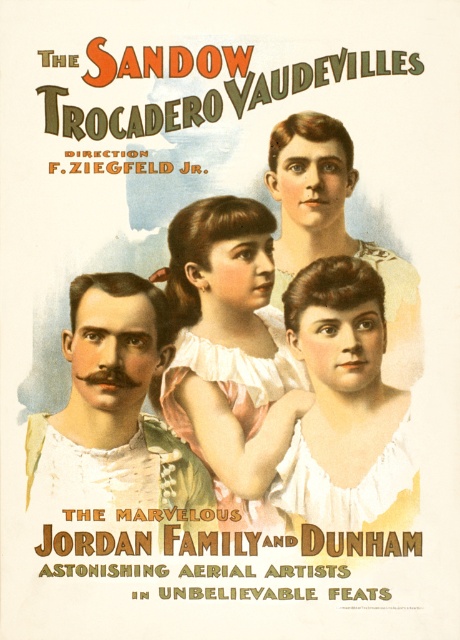
Question: Which object is closer to the camera taking this photo?

Choices:
 (A) matte white blouse at center
 (B) matte white blouse at upper center

Answer: (A)

Question: Does matte white blouse at center have a lesser width compared to matte white blouse at upper center?

Choices:
 (A) no
 (B) yes

Answer: (B)

Question: Does pink satin dress at center have a greater width compared to mustached man at center?

Choices:
 (A) yes
 (B) no

Answer: (B)

Question: Is pink satin dress at center thinner than mustached man at center?

Choices:
 (A) yes
 (B) no

Answer: (A)

Question: Which of these objects is positioned farthest from the matte white blouse at upper center?

Choices:
 (A) mustached man at center
 (B) pink satin dress at center
 (C) matte white blouse at center

Answer: (A)

Question: Which object appears closest to the camera in this image?

Choices:
 (A) mustached man at center
 (B) matte white blouse at center
 (C) matte white blouse at upper center

Answer: (A)